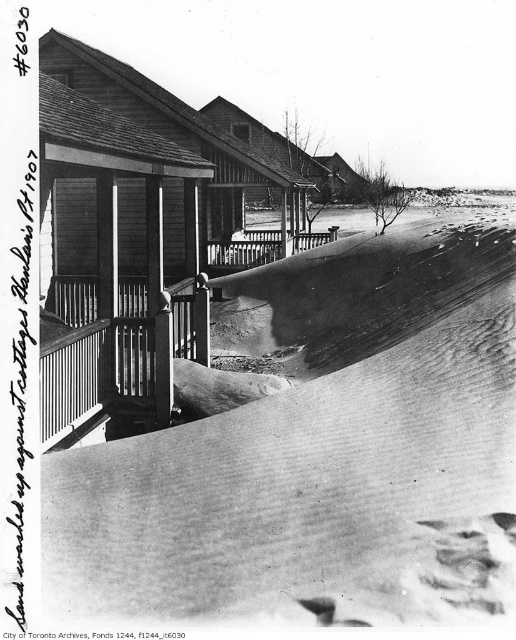
You are standing at the origin point in the image. Where is the wooden porch at center located in 2D coordinates?

The wooden porch at center is located at the 2D coordinates of point (180, 136).

You are a delivery person trying to reach the wooden porch at center to drop off a package. There is white powdery snow at center in the way. Can you walk around it if you have 10 meters of space to maneuver?

The distance between the white powdery snow at center and the wooden porch at center is 8.19 meters. Since you have 10 meters of space to maneuver, you can walk around the white powdery snow at center to reach the wooden porch at center.

You are standing on the beach and see the wooden porch at center and the wooden cabin at center. Which one is closer to your right side?

The wooden cabin at center is closer to your right side because the wooden porch at center is to the left of it.